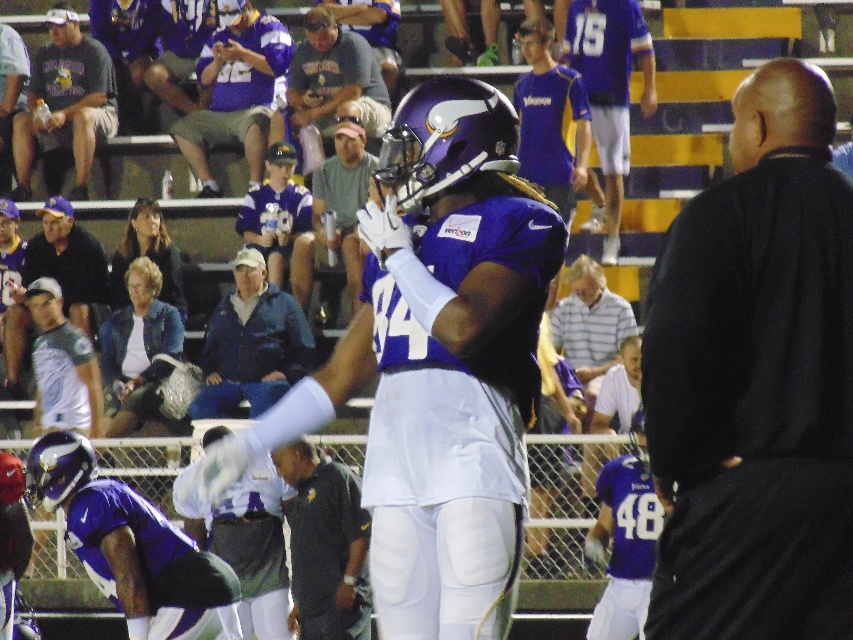
Who is lower down, dark gray uniform at center or gray fabric jacket at center?

Positioned lower is dark gray uniform at center.

Is point (318, 556) farther from viewer compared to point (316, 180)?

No, it is not.

Where is `dark gray uniform at center`? The image size is (853, 640). dark gray uniform at center is located at coordinates [323, 544].

Is point (817, 355) positioned behind point (251, 532)?

No.

Can you confirm if black smooth shirt at right is bigger than white matte jersey at center?

No, black smooth shirt at right is not bigger than white matte jersey at center.

Measure the distance between black smooth shirt at right and camera.

black smooth shirt at right and camera are 8.10 meters apart.

Locate an element on the screen. The image size is (853, 640). black smooth shirt at right is located at coordinates (756, 380).

Can you confirm if dark gray uniform at center is shorter than light blue denim jacket at upper left?

No.

From the picture: Which is more to the left, dark gray uniform at center or light blue denim jacket at upper left?

light blue denim jacket at upper left is more to the left.

Which is behind, point (346, 550) or point (83, 257)?

Positioned behind is point (83, 257).

This screenshot has width=853, height=640. I want to click on dark gray uniform at center, so click(x=323, y=544).